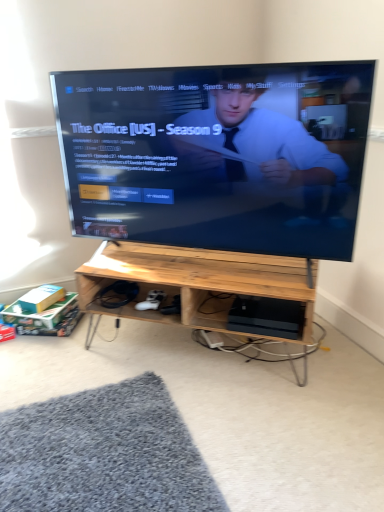
The height and width of the screenshot is (512, 384). In order to click on black glossy tv at center in this screenshot , I will do `click(217, 155)`.

Does black glossy tv at center appear on the left side of black plastic computer at lower center?

Yes.

From a real-world perspective, is black glossy tv at center beneath black plastic computer at lower center?

Actually, black glossy tv at center is physically above black plastic computer at lower center in the real world.

I want to click on computer beneath the black glossy tv at center (from a real-world perspective), so click(267, 316).

From the image's perspective, is black plastic computer at lower center under black glossy tv at center?

Correct, black plastic computer at lower center appears lower than black glossy tv at center in the image.

Which object is thinner, black plastic computer at lower center or black glossy tv at center?

Thinner between the two is black glossy tv at center.

Do you think black plastic computer at lower center is within black glossy tv at center, or outside of it?

The correct answer is: outside.

Is natural wood desk at center spatially inside black glossy tv at center, or outside of it?

natural wood desk at center cannot be found inside black glossy tv at center.

Looking at this image, from the image's perspective, which is below, natural wood desk at center or black glossy tv at center?

From the image's view, natural wood desk at center is below.

What's the angular difference between natural wood desk at center and black glossy tv at center's facing directions?

The facing directions of natural wood desk at center and black glossy tv at center are 3.61e-05 degrees apart.

How distant is natural wood desk at center from black glossy tv at center?

natural wood desk at center and black glossy tv at center are 12.68 inches apart.

Consider the image. Is natural wood desk at center further to camera compared to black plastic computer at lower center?

No, natural wood desk at center is closer to the viewer.

In terms of size, does natural wood desk at center appear bigger or smaller than black plastic computer at lower center?

Considering their sizes, natural wood desk at center takes up more space than black plastic computer at lower center.

Consider the image. Is natural wood desk at center facing away from black plastic computer at lower center?

Correct, natural wood desk at center is looking away from black plastic computer at lower center.

How different are the orientations of natural wood desk at center and black plastic computer at lower center in degrees?

They differ by 1.87e-05 degrees in their facing directions.

Who is more distant, black plastic computer at lower center or natural wood desk at center?

black plastic computer at lower center is behind.

Would you say black plastic computer at lower center is to the left or to the right of natural wood desk at center in the picture?

From the image, it's evident that black plastic computer at lower center is to the right of natural wood desk at center.

Would you say natural wood desk at center is part of black plastic computer at lower center's contents?

No, natural wood desk at center is not surrounded by black plastic computer at lower center.

How many degrees apart are the facing directions of black glossy tv at center and natural wood desk at center?

The angle between the facing direction of black glossy tv at center and the facing direction of natural wood desk at center is 3.61e-05 degrees.

Between black glossy tv at center and natural wood desk at center, which one is positioned in front?

black glossy tv at center.

Is black glossy tv at center inside or outside of natural wood desk at center?

black glossy tv at center is not inside natural wood desk at center, it's outside.

Is black glossy tv at center wider or thinner than natural wood desk at center?

Clearly, black glossy tv at center has less width compared to natural wood desk at center.

Locate an element on the screen. The height and width of the screenshot is (512, 384). television on the left side of black plastic computer at lower center is located at coordinates (217, 155).

Where is `computer located behind the black glossy tv at center`? computer located behind the black glossy tv at center is located at coordinates (267, 316).

Which object lies nearer to the anchor point black glossy tv at center, black plastic computer at lower center or natural wood desk at center?

Based on the image, natural wood desk at center appears to be nearer to black glossy tv at center.

From the picture: Which object lies nearer to the anchor point natural wood desk at center, black plastic computer at lower center or black glossy tv at center?

black plastic computer at lower center is positioned closer to the anchor natural wood desk at center.

Considering their positions, is black glossy tv at center positioned further to black plastic computer at lower center than natural wood desk at center?

The object further to black plastic computer at lower center is black glossy tv at center.

From the image, which object appears to be farther from black plastic computer at lower center, natural wood desk at center or black glossy tv at center?

black glossy tv at center is positioned further to the anchor black plastic computer at lower center.

From the picture: Considering their positions, is natural wood desk at center positioned closer to black glossy tv at center than black plastic computer at lower center?

Based on the image, natural wood desk at center appears to be nearer to black glossy tv at center.

Based on their spatial positions, is black glossy tv at center or black plastic computer at lower center further from natural wood desk at center?

Based on the image, black glossy tv at center appears to be further to natural wood desk at center.

Identify the location of desk between black glossy tv at center and black plastic computer at lower center vertically. Image resolution: width=384 pixels, height=512 pixels. (196, 286).